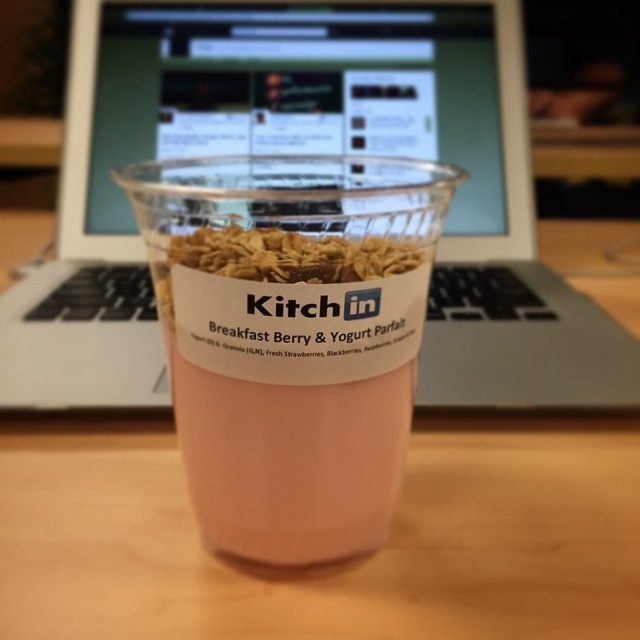
You are setting up a workspace and need to place both the sleek silver laptop at center and the pink translucent cup at center on a shelf. The shelf has limited vertical space. Which item should you prioritize placing first to ensure both fit vertically?

The pink translucent cup at center should be placed first because the sleek silver laptop at center is taller, so positioning the taller item first ensures there is enough space for the shorter cup afterward.

Looking at this image, you are a delivery robot with a 30 cm wide arm. You need to place a package between the sleek silver laptop at center and the pink translucent cup at center. Can your arm fit in the space between them?

The distance between the sleek silver laptop at center and the pink translucent cup at center is 26.41 centimeters. Since your arm is 30 cm wide, it cannot fit in the space between them because the space is narrower than the arm.

You are trying to reach the point marked at coordinates point [561,451] in the image. If your hand is 12 inches long when fully extended, can you reach that point without moving your body?

The distance between you and point [561,451] is 16.06 inches. Since your hand can only extend 12 inches, you cannot reach it without moving your body.